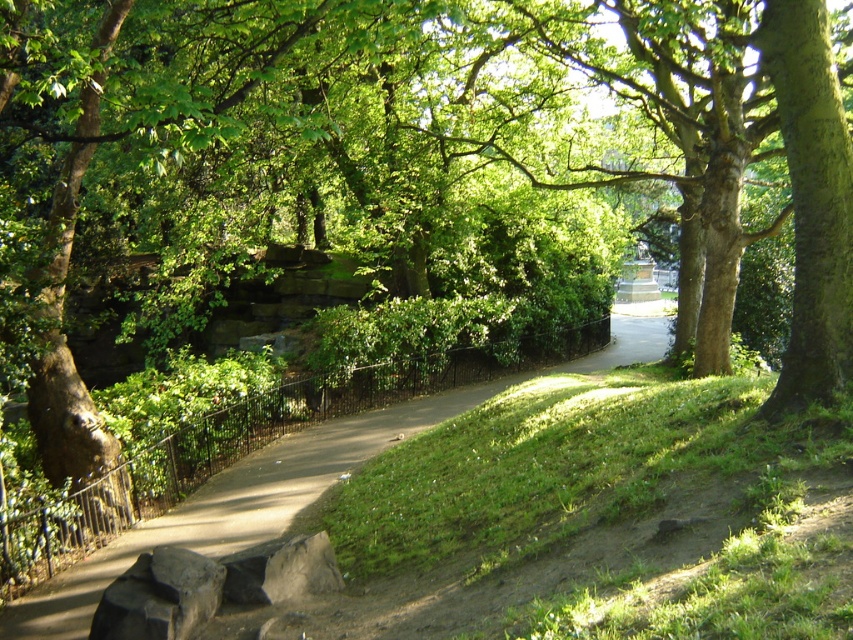
Which is behind, point (175, 512) or point (321, 538)?

The point (175, 512) is behind.

Which of these two, smooth concrete path at center or gray rough stone at lower center, stands taller?

With more height is smooth concrete path at center.

Locate an element on the screen. This screenshot has height=640, width=853. smooth concrete path at center is located at coordinates (236, 506).